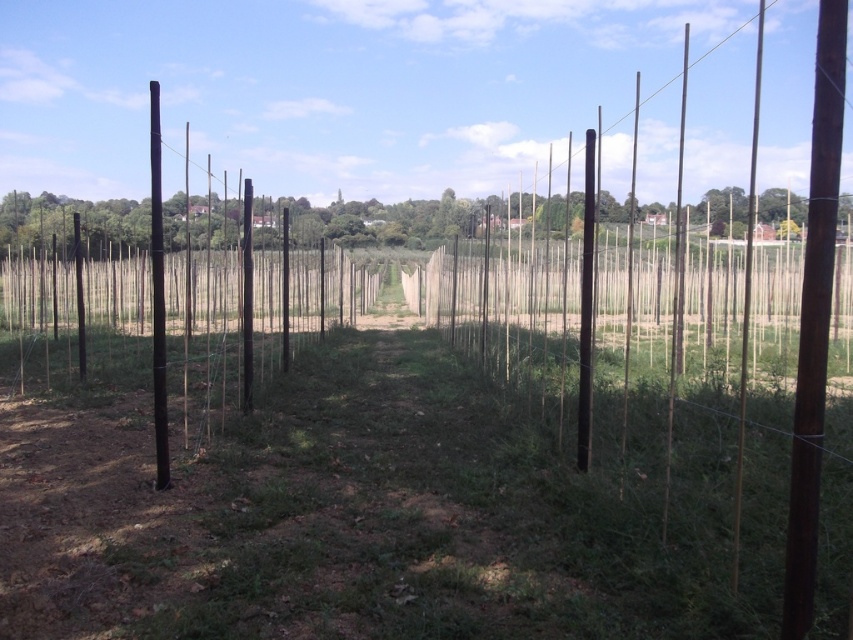
You are walking along the path in the vineyard and see the green wood fence at center and the black smooth pole at left. Which object is closer to the left side of the image?

The black smooth pole at left is closer to the left side of the image because it is positioned to the left of the green wood fence at center.